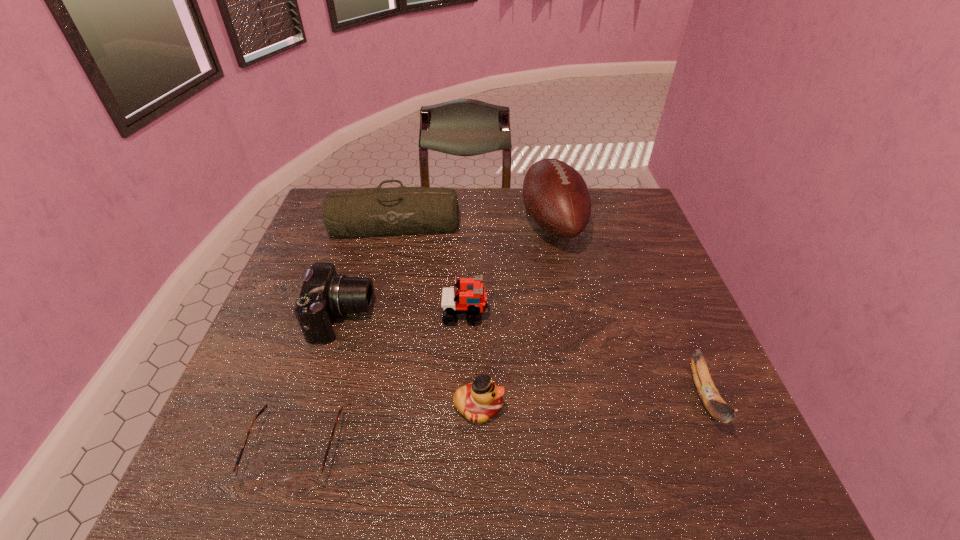
This screenshot has width=960, height=540. Find the location of `free region located on the lens of the camera`. free region located on the lens of the camera is located at coordinates (403, 318).

I want to click on blank space located 0.390m on the front-facing side of the Lego, so click(643, 313).

Identify the location of free space located at the stem of the rightmost object. Image resolution: width=960 pixels, height=540 pixels. (747, 496).

Identify the location of free point located 0.210m on the face of the duck. This screenshot has width=960, height=540. (605, 407).

Identify the location of football (American) that is at the far edge. (556, 197).

This screenshot has height=540, width=960. I want to click on duffel bag that is positioned at the far edge, so [x=364, y=212].

At what (x,y) coordinates should I click in order to perform the action: click on object positioned at the near edge. Please return your answer as a coordinate pair (x, y). Looking at the image, I should click on (303, 483).

Locate an element on the screen. duffel bag at the left edge is located at coordinates (364, 212).

Where is `camera situated at the left edge`? This screenshot has width=960, height=540. camera situated at the left edge is located at coordinates (325, 294).

Where is `spectacles that is positioned at the left edge`? spectacles that is positioned at the left edge is located at coordinates (303, 483).